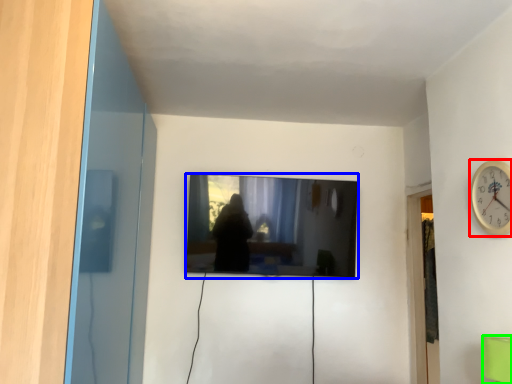
Question: Based on their relative distances, which object is farther from wall clock (highlighted by a red box)? Choose from television (highlighted by a blue box) and furniture (highlighted by a green box).

Choices:
 (A) television
 (B) furniture

Answer: (A)